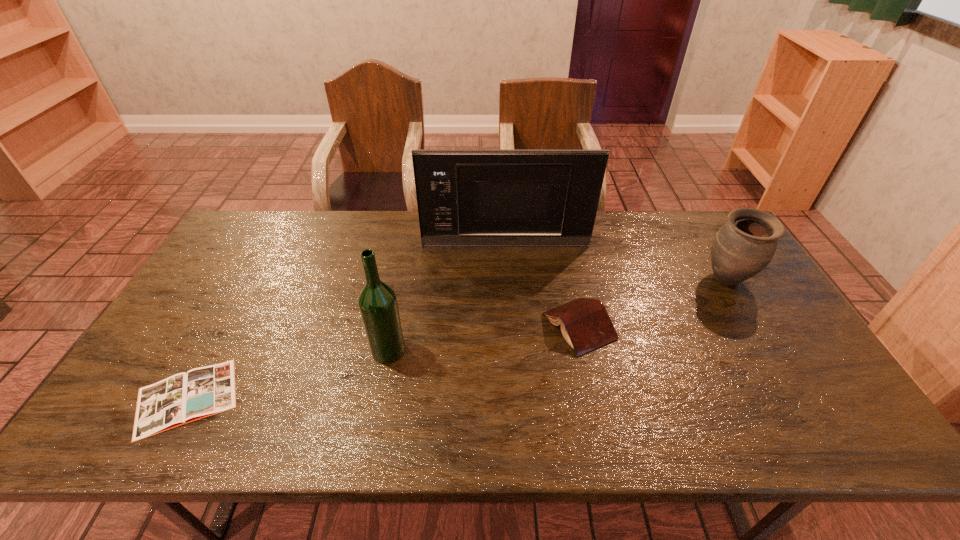
Image resolution: width=960 pixels, height=540 pixels. Find the location of `free space located 0.390m on the front of the rightmost object`. free space located 0.390m on the front of the rightmost object is located at coordinates (810, 421).

I want to click on vacant space located 0.290m on the left of the farther book, so click(x=438, y=326).

Locate an element on the screen. The width and height of the screenshot is (960, 540). vacant area situated 0.360m on the back of the shortest object is located at coordinates [259, 266].

Image resolution: width=960 pixels, height=540 pixels. In order to click on object at the far edge in this screenshot , I will do `click(478, 198)`.

What are the coordinates of `object located in the near edge section of the desktop` in the screenshot? It's located at click(x=182, y=398).

This screenshot has height=540, width=960. In order to click on object situated at the left edge in this screenshot , I will do `click(182, 398)`.

Image resolution: width=960 pixels, height=540 pixels. What are the coordinates of `object present at the right edge` in the screenshot? It's located at (746, 243).

The height and width of the screenshot is (540, 960). Find the location of `object that is positioned at the near left corner`. object that is positioned at the near left corner is located at coordinates (182, 398).

This screenshot has width=960, height=540. In the image, there is a desktop. Identify the location of free space at the far edge. (418, 235).

This screenshot has height=540, width=960. I want to click on vacant region at the near edge of the desktop, so click(468, 410).